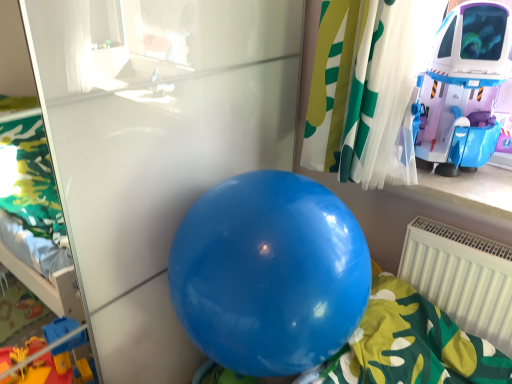
Question: Considering the positions of point (500, 273) and point (263, 306), is point (500, 273) closer or farther from the camera than point (263, 306)?

Choices:
 (A) closer
 (B) farther

Answer: (B)

Question: Is white plastic radiator at lower right bigger or smaller than glossy blue balloon at center?

Choices:
 (A) big
 (B) small

Answer: (B)

Question: Which object is the closest to the white plastic radiator at lower right?

Choices:
 (A) shiny plastic spaceship at upper right
 (B) glossy blue balloon at center

Answer: (A)

Question: Estimate the real-world distances between objects in this image. Which object is closer to the shiny plastic spaceship at upper right?

Choices:
 (A) white plastic radiator at lower right
 (B) glossy blue balloon at center

Answer: (A)